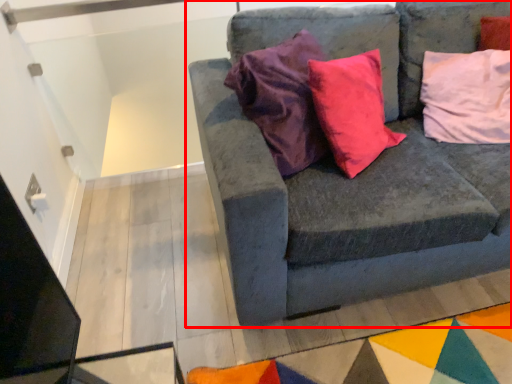
Question: From the image's perspective, considering the relative positions of studio couch (annotated by the red box) and pillow in the image provided, where is studio couch (annotated by the red box) located with respect to the staircase?

Choices:
 (A) below
 (B) above

Answer: (A)